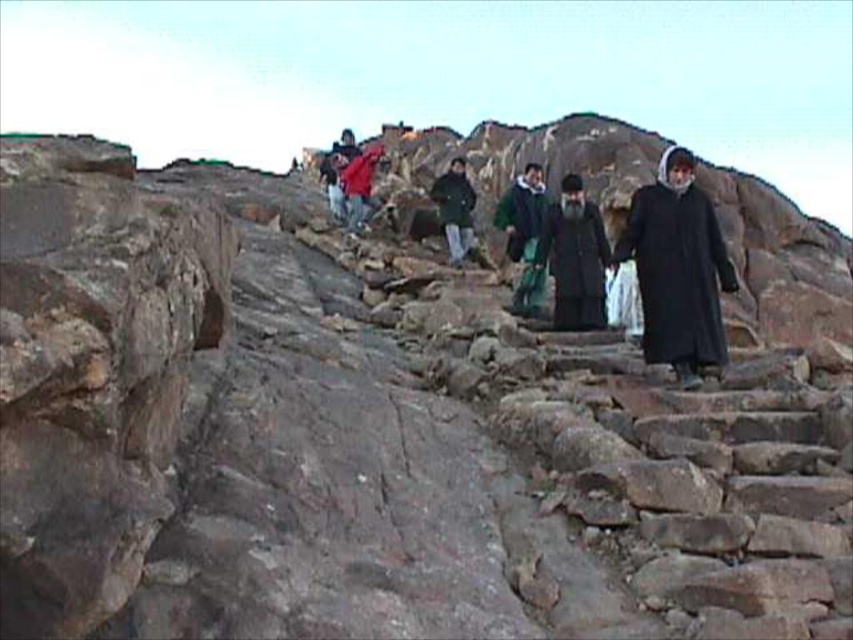
Is point (515, 230) positioned behind point (454, 177)?

No, (515, 230) is in front of (454, 177).

Between green fabric coat at center and dark green fabric jacket at center, which one appears on the right side from the viewer's perspective?

Positioned to the right is green fabric coat at center.

At what (x,y) coordinates should I click in order to perform the action: click on green fabric coat at center. Please return your answer as a coordinate pair (x, y). The image size is (853, 640). Looking at the image, I should click on (524, 236).

Is black matte robe at right closer to the viewer compared to black matte robe at center?

Yes, black matte robe at right is closer to the viewer.

Which is above, black matte robe at right or black matte robe at center?

black matte robe at right is higher up.

What do you see at coordinates (677, 273) in the screenshot? I see `black matte robe at right` at bounding box center [677, 273].

Identify the location of black matte robe at right. (677, 273).

Is black matte robe at right positioned behind green fabric coat at center?

No, black matte robe at right is closer to the viewer.

Does point (701, 236) come in front of point (538, 176)?

Yes, it is in front of point (538, 176).

The image size is (853, 640). I want to click on black matte robe at right, so click(x=677, y=273).